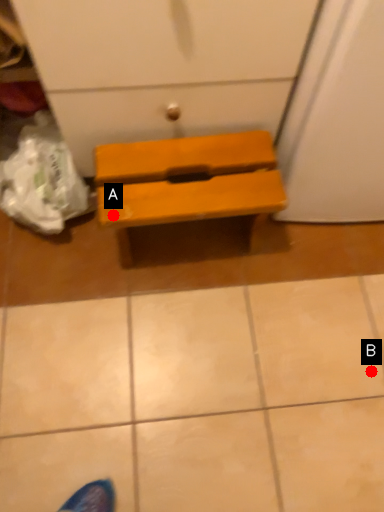
Question: Two points are circled on the image, labeled by A and B beside each circle. Which of the following is the closest to the observer?

Choices:
 (A) A is closer
 (B) B is closer

Answer: (A)